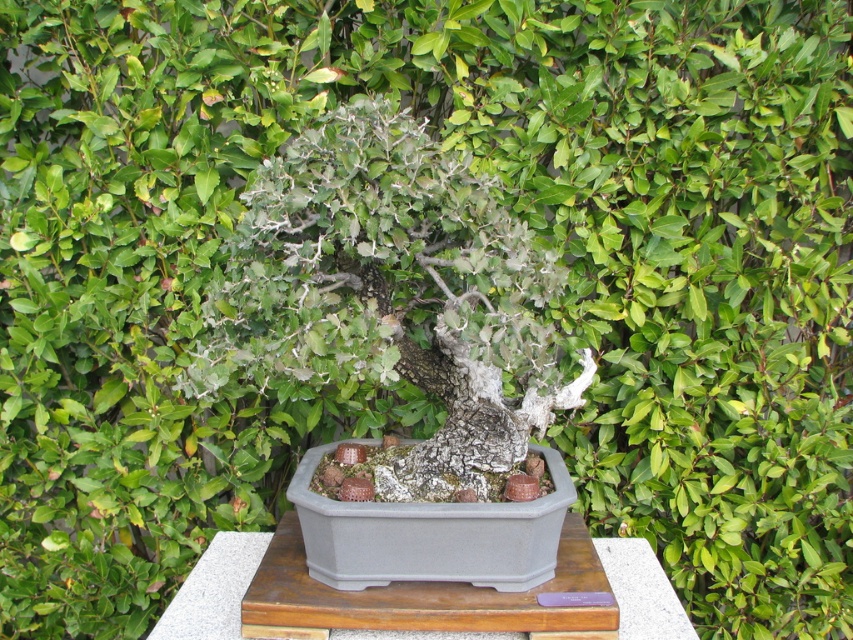
Measure the distance between point (537, 323) and camera.

Point (537, 323) is 4.05 feet away from camera.

Does gray bark bonsai at center appear on the right side of gray wood table at center?

No, gray bark bonsai at center is not to the right of gray wood table at center.

Locate an element on the screen. The width and height of the screenshot is (853, 640). gray bark bonsai at center is located at coordinates (395, 292).